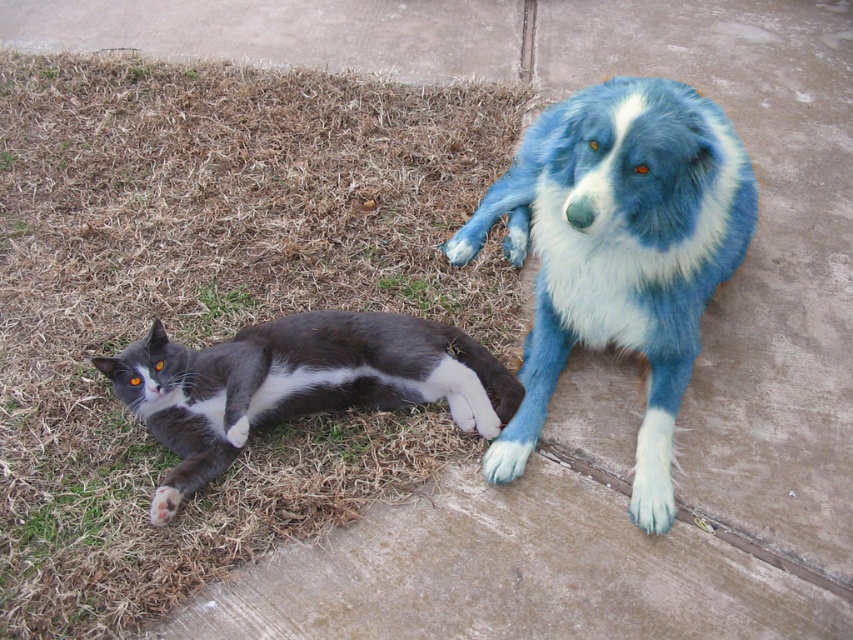
Where is `green grass at lower left`? green grass at lower left is located at coordinates pos(213,301).

Which is in front, point (61, 435) or point (531, 436)?

Point (531, 436)

Locate an element on the screen. green grass at lower left is located at coordinates (213, 301).

Is green grass at lower left bigger than gray-white fur cat at lower left?

Yes.

Is point (258, 250) closer to viewer compared to point (366, 339)?

That is False.

What are the coordinates of `green grass at lower left` in the screenshot? It's located at (213, 301).

Does point (664, 212) lie behind point (155, 516)?

No, it is not.

Is blue fluffy dog at upper right positioned behind gray-white fur cat at lower left?

No, it is in front of gray-white fur cat at lower left.

The height and width of the screenshot is (640, 853). What are the coordinates of `blue fluffy dog at upper right` in the screenshot? It's located at (618, 252).